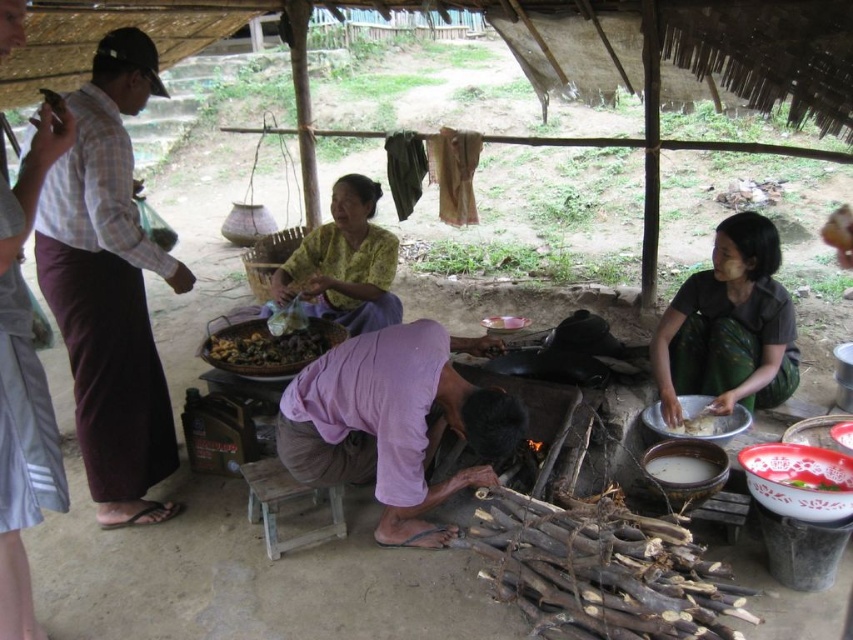
Who is higher up, purple cotton shirt at center or white matte rice at lower right?

Positioned higher is white matte rice at lower right.

Is point (303, 412) farther from camera compared to point (711, 426)?

That is False.

I want to click on purple cotton shirt at center, so click(393, 422).

Is porcelain bowl at lower right smaller than wooden stool at center?

Yes.

How far apart are porcelain bowl at lower right and wooden stool at center?

porcelain bowl at lower right and wooden stool at center are 1.50 meters apart.

Based on the photo, who is more distant from viewer, (757, 477) or (283, 486)?

Point (283, 486)

Where is `porcelain bowl at lower right`? porcelain bowl at lower right is located at coordinates (799, 481).

Who is higher up, plaid fabric shirt at left or white glossy bowl at lower right?

plaid fabric shirt at left is higher up.

Is point (113, 298) farther from camera compared to point (827, 483)?

Yes, point (113, 298) is behind point (827, 483).

Identify the location of plaid fabric shirt at left. Image resolution: width=853 pixels, height=640 pixels. (109, 285).